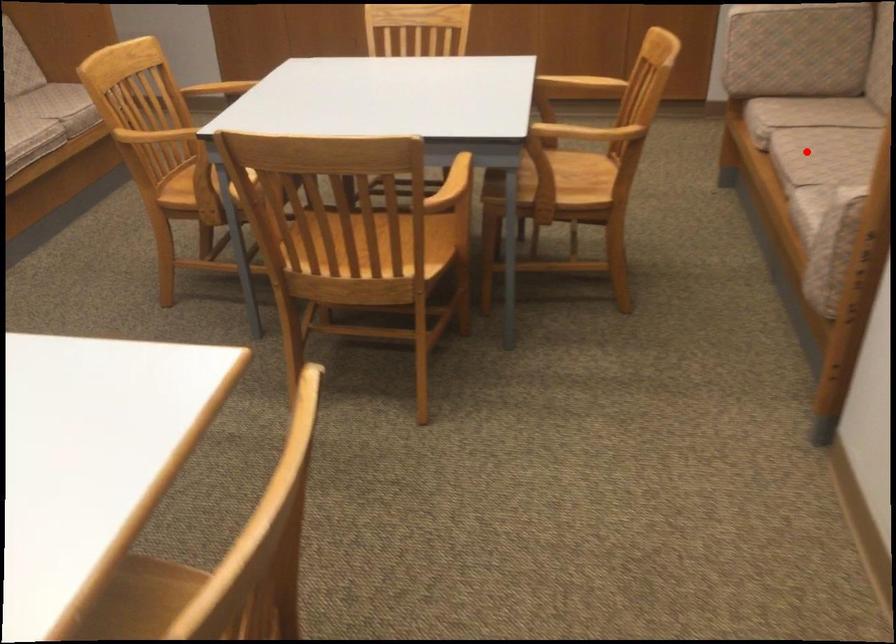
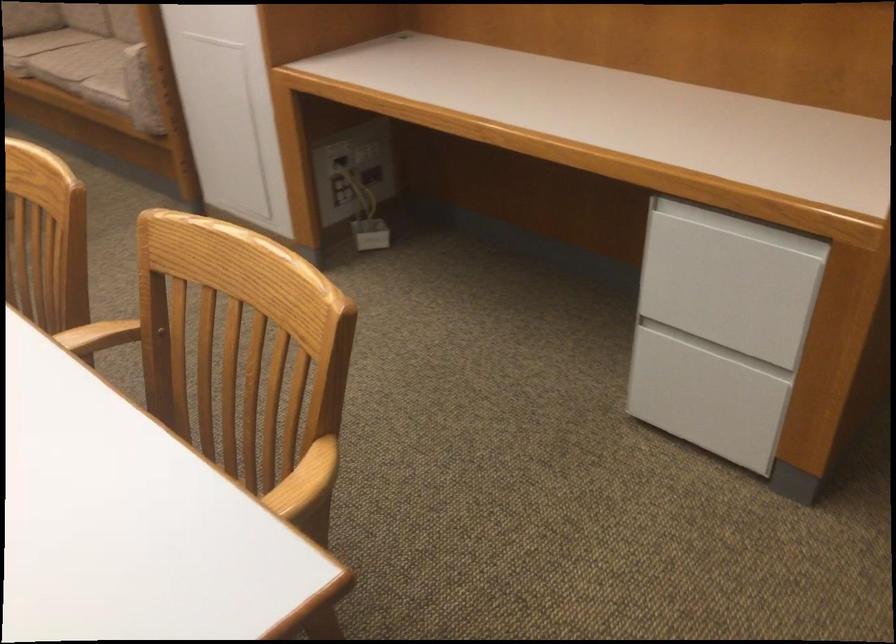
Question: I am providing you with two images of the same scene from different viewpoints. In image1, a red point is highlighted. Considering the same 3D point in image2, which of the following is correct?

Choices:
 (A) It is closer
 (B) It is farther

Answer: (B)